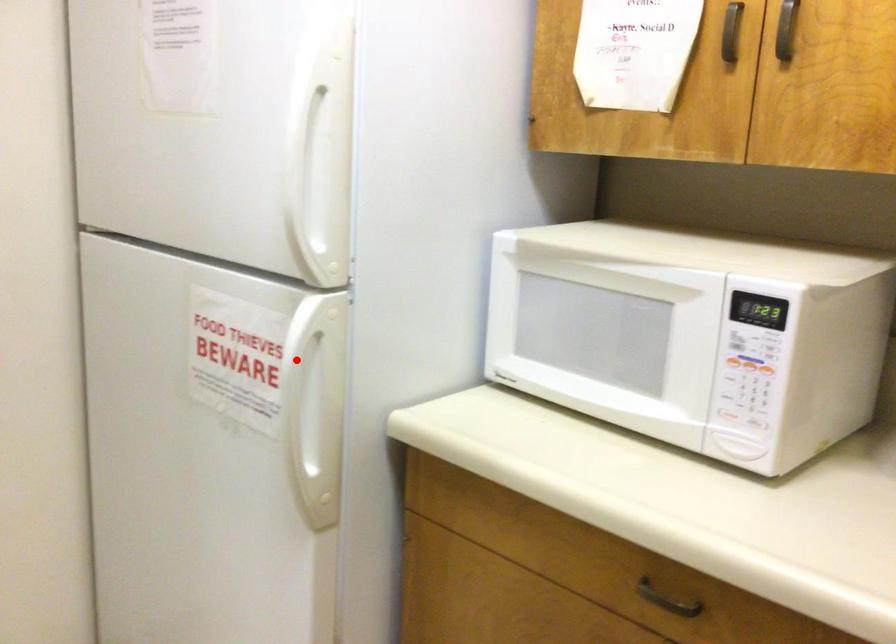
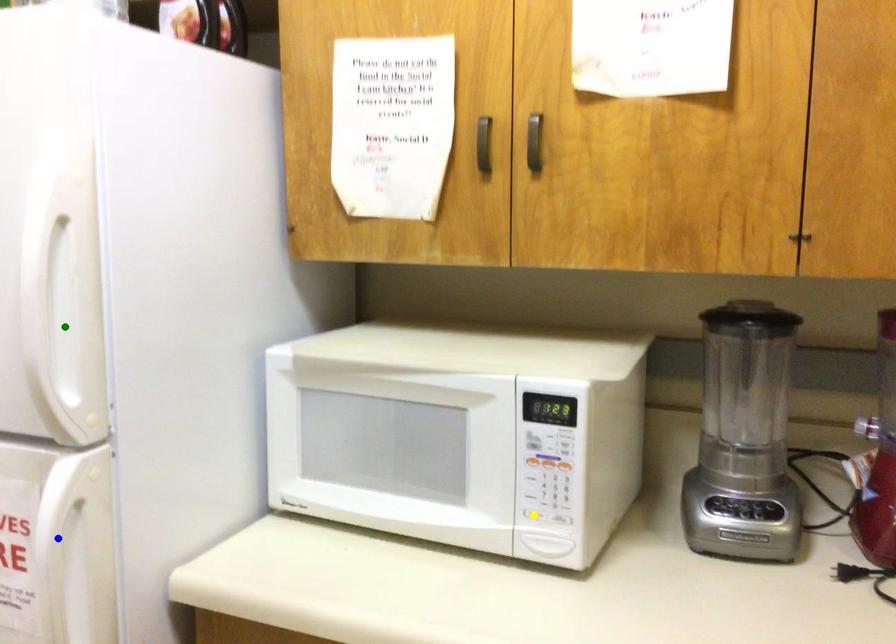
Question: I am providing you with two images of the same scene from different viewpoints. A red point is marked on the first image. You are given multiple points on the second image. Which spot in image 2 lines up with the point in image 1?

Choices:
 (A) blue point
 (B) yellow point
 (C) green point

Answer: (A)